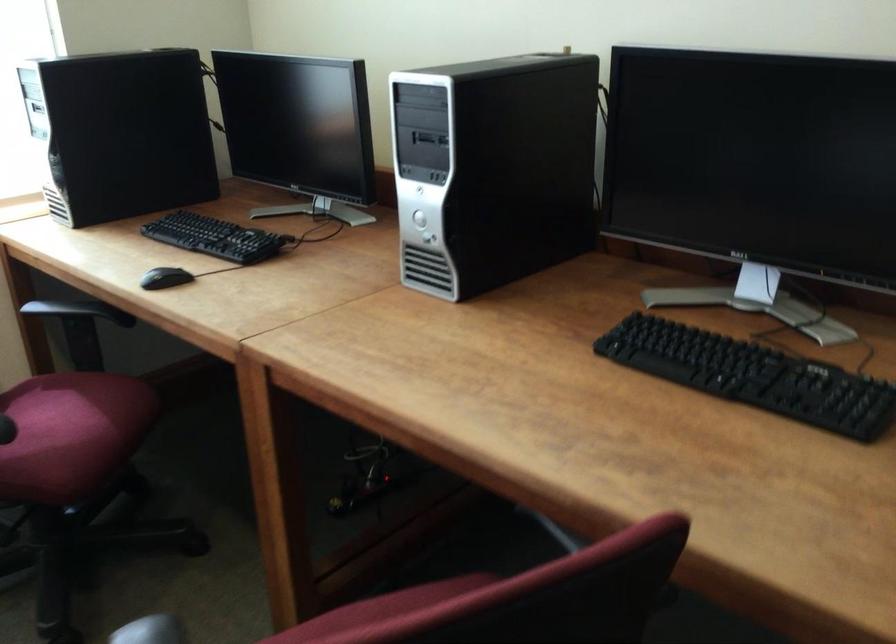
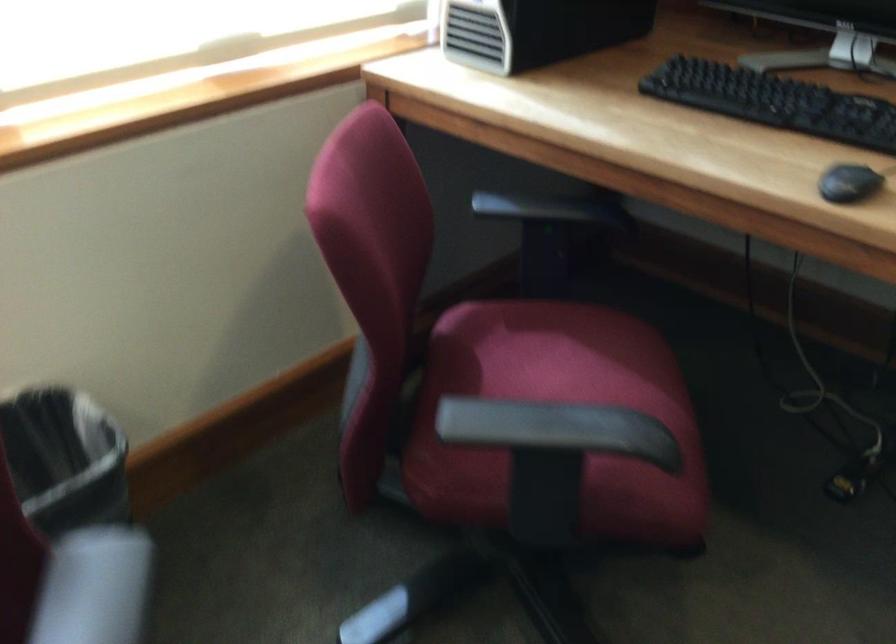
Find the pixel in the second image that matches pixel 153 281 in the first image.

(848, 183)